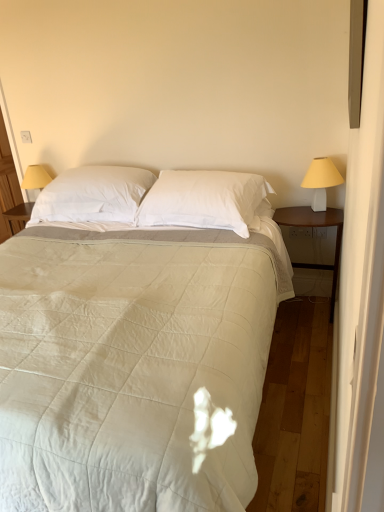
This screenshot has height=512, width=384. Describe the element at coordinates (135, 340) in the screenshot. I see `white quilted fabric bed at center` at that location.

Where is `white quilted fabric bed at center`? This screenshot has width=384, height=512. white quilted fabric bed at center is located at coordinates (135, 340).

This screenshot has height=512, width=384. I want to click on matte wooden screen door at left, so click(x=8, y=186).

Locate an element on the screen. Image resolution: width=384 pixels, height=512 pixels. white plastic lampshade at right is located at coordinates (321, 181).

Measure the distance between point (278, 209) and camera.

Point (278, 209) is 8.98 feet away from camera.

What is the approximate width of white soft pillow at center, marked as the 1th pillow in a left-to-right arrangement?

It is 19.37 inches.

Locate an element on the screen. Image resolution: width=384 pixels, height=512 pixels. white quilted fabric bed at center is located at coordinates (135, 340).

Is there a large distance between white soft pillow at center, which is the 2th pillow in right-to-left order, and matte wooden screen door at left?

Yes, white soft pillow at center, which is the 2th pillow in right-to-left order, and matte wooden screen door at left are located far from each other.

Between white soft pillow at center, marked as the 1th pillow in a left-to-right arrangement, and matte wooden screen door at left, which one appears on the right side from the viewer's perspective?

From the viewer's perspective, white soft pillow at center, marked as the 1th pillow in a left-to-right arrangement, appears more on the right side.

Who is more distant, white soft pillow at center, marked as the 1th pillow in a left-to-right arrangement, or matte wooden screen door at left?

Positioned behind is matte wooden screen door at left.

Based on the photo, from a real-world perspective, which is physically above, white soft pillow at center, marked as the 1th pillow in a left-to-right arrangement, or matte wooden screen door at left?

white soft pillow at center, marked as the 1th pillow in a left-to-right arrangement.

From the picture: Which of these two, matte wooden screen door at left or white soft pillow at center, marked as the 1th pillow in a left-to-right arrangement, stands taller?

matte wooden screen door at left.

Which of these two, matte wooden screen door at left or white soft pillow at center, marked as the 1th pillow in a left-to-right arrangement, is wider?

white soft pillow at center, marked as the 1th pillow in a left-to-right arrangement, is wider.

From the image's perspective, is matte wooden screen door at left on white soft pillow at center, which is the 2th pillow in right-to-left order?

Yes, from the image's perspective, matte wooden screen door at left is over white soft pillow at center, which is the 2th pillow in right-to-left order.

Is matte wooden screen door at left oriented away from white soft pillow at center, marked as the 1th pillow in a left-to-right arrangement?

No, matte wooden screen door at left is not facing the opposite direction of white soft pillow at center, marked as the 1th pillow in a left-to-right arrangement.

From the image's perspective, which is above, yellow fabric lampshade at left or white cotton pillow at center, arranged as the 2th pillow when viewed from the left?

yellow fabric lampshade at left, from the image's perspective.

Does yellow fabric lampshade at left have a greater height compared to white cotton pillow at center, arranged as the 2th pillow when viewed from the left?

Indeed, yellow fabric lampshade at left has a greater height compared to white cotton pillow at center, arranged as the 2th pillow when viewed from the left.

Locate an element on the screen. table lamp on the left of white cotton pillow at center, arranged as the 2th pillow when viewed from the left is located at coordinates (35, 178).

Measure the distance from yellow fabric lampshade at left to white cotton pillow at center, arranged as the 2th pillow when viewed from the left.

yellow fabric lampshade at left is 1.33 meters from white cotton pillow at center, arranged as the 2th pillow when viewed from the left.

Is white quilted fabric bed at center in front of or behind white plastic lampshade at right in the image?

Clearly, white quilted fabric bed at center is in front of white plastic lampshade at right.

Which object is positioned more to the right, white quilted fabric bed at center or white plastic lampshade at right?

white plastic lampshade at right is more to the right.

Is white quilted fabric bed at center bigger than white plastic lampshade at right?

Yes.

The width and height of the screenshot is (384, 512). In order to click on bedside lamp behind the white quilted fabric bed at center in this screenshot , I will do `click(321, 181)`.

In the scene shown: Considering the relative sizes of wooden nightstand at right and white plastic lampshade at right in the image provided, is wooden nightstand at right smaller than white plastic lampshade at right?

No, wooden nightstand at right is not smaller than white plastic lampshade at right.

In the scene shown: From a real-world perspective, who is located higher, wooden nightstand at right or white plastic lampshade at right?

white plastic lampshade at right, from a real-world perspective.

Is wooden nightstand at right facing away from white plastic lampshade at right?

No.

Which of these two, white cotton pillow at center, arranged as the 2th pillow when viewed from the left, or white quilted fabric bed at center, stands taller?

white quilted fabric bed at center.

Image resolution: width=384 pixels, height=512 pixels. In order to click on the 1st pillow behind the white quilted fabric bed at center, starting your count from the anchor in this screenshot , I will do pyautogui.click(x=203, y=199).

Is white cotton pillow at center, which is counted as the first pillow, starting from the right, bigger than white quilted fabric bed at center?

Actually, white cotton pillow at center, which is counted as the first pillow, starting from the right, might be smaller than white quilted fabric bed at center.

Consider the image. From a real-world perspective, which object stands above the other?

From a 3D spatial view, white soft pillow at center, marked as the 1th pillow in a left-to-right arrangement, is above.

Are white plastic lampshade at right and white soft pillow at center, marked as the 1th pillow in a left-to-right arrangement, far apart?

white plastic lampshade at right is far away from white soft pillow at center, marked as the 1th pillow in a left-to-right arrangement.

From the picture: Considering the sizes of objects white plastic lampshade at right and white soft pillow at center, which is the 2th pillow in right-to-left order, in the image provided, who is wider, white plastic lampshade at right or white soft pillow at center, which is the 2th pillow in right-to-left order,?

Wider between the two is white soft pillow at center, which is the 2th pillow in right-to-left order.

Based on the photo, is white soft pillow at center, marked as the 1th pillow in a left-to-right arrangement, at the back of white plastic lampshade at right?

white plastic lampshade at right is not turned away from white soft pillow at center, marked as the 1th pillow in a left-to-right arrangement.

You are a GUI agent. You are given a task and a screenshot of the screen. Output one action in this format:
    pyautogui.click(x=<x>, y=<y>)
    Task: Click on the screen door lying on the left of white soft pillow at center, marked as the 1th pillow in a left-to-right arrangement
    This screenshot has width=384, height=512.
    Given the screenshot: What is the action you would take?
    pyautogui.click(x=8, y=186)

Find the location of a particular element. pillow that is above the matte wooden screen door at left (from a real-world perspective) is located at coordinates (93, 195).

When comparing their distances from wooden nightstand at right, does white quilted fabric bed at center or white cotton pillow at center, arranged as the 2th pillow when viewed from the left, seem closer?

Among the two, white cotton pillow at center, arranged as the 2th pillow when viewed from the left, is located nearer to wooden nightstand at right.

From the image, which object appears to be nearer to white plastic lampshade at right, matte wooden screen door at left or white quilted fabric bed at center?

The object closer to white plastic lampshade at right is white quilted fabric bed at center.

Estimate the real-world distances between objects in this image. Which object is closer to matte wooden screen door at left, white plastic lampshade at right or wooden nightstand at right?

Based on the image, wooden nightstand at right appears to be nearer to matte wooden screen door at left.

Looking at the image, which one is located closer to matte wooden screen door at left, yellow fabric lampshade at left or white quilted fabric bed at center?

yellow fabric lampshade at left lies closer to matte wooden screen door at left than the other object.

Based on their spatial positions, is white plastic lampshade at right or white soft pillow at center, which is the 2th pillow in right-to-left order, closer to wooden nightstand at right?

white plastic lampshade at right lies closer to wooden nightstand at right than the other object.

From the image, which object appears to be nearer to white cotton pillow at center, which is counted as the first pillow, starting from the right, white soft pillow at center, which is the 2th pillow in right-to-left order, or matte wooden screen door at left?

→ white soft pillow at center, which is the 2th pillow in right-to-left order.

Considering their positions, is wooden nightstand at right positioned closer to white soft pillow at center, marked as the 1th pillow in a left-to-right arrangement, than white cotton pillow at center, which is counted as the first pillow, starting from the right?

white cotton pillow at center, which is counted as the first pillow, starting from the right, lies closer to white soft pillow at center, marked as the 1th pillow in a left-to-right arrangement, than the other object.

Which object lies further to the anchor point white cotton pillow at center, which is counted as the first pillow, starting from the right, white quilted fabric bed at center or wooden nightstand at right?

Based on the image, wooden nightstand at right appears to be further to white cotton pillow at center, which is counted as the first pillow, starting from the right.

The image size is (384, 512). Identify the location of pillow between white soft pillow at center, marked as the 1th pillow in a left-to-right arrangement, and white plastic lampshade at right from left to right. (203, 199).

You are a GUI agent. You are given a task and a screenshot of the screen. Output one action in this format:
    pyautogui.click(x=<x>, y=<y>)
    Task: Click on the table lamp between white quilted fabric bed at center and matte wooden screen door at left from front to back
    The height and width of the screenshot is (512, 384).
    Given the screenshot: What is the action you would take?
    pyautogui.click(x=35, y=178)

Image resolution: width=384 pixels, height=512 pixels. I want to click on table lamp between matte wooden screen door at left and wooden nightstand at right from left to right, so click(35, 178).

The height and width of the screenshot is (512, 384). What are the coordinates of `bedside lamp between white quilted fabric bed at center and wooden nightstand at right along the z-axis` in the screenshot? It's located at click(x=321, y=181).